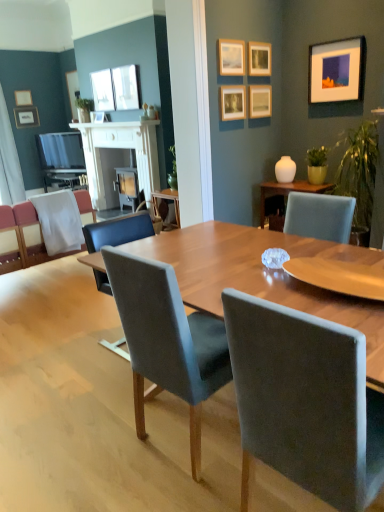
You are a GUI agent. You are given a task and a screenshot of the screen. Output one action in this format:
    pyautogui.click(x=<x>, y=<y>)
    Task: Click on the vacant point above clear glass window screen at upper center (from a real-world perspective)
    
    Given the screenshot: What is the action you would take?
    pyautogui.click(x=91, y=72)